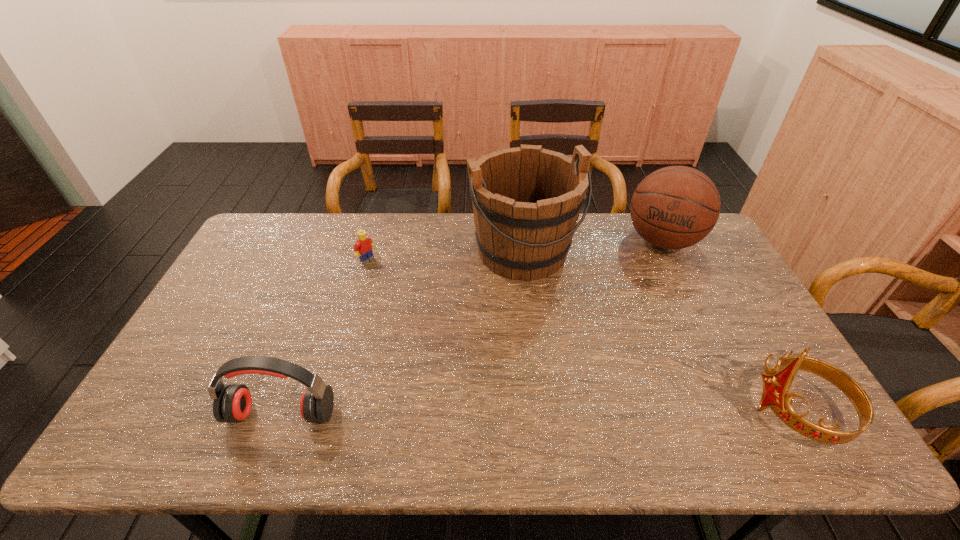
Where is `basketball located in the far edge section of the desktop`? The width and height of the screenshot is (960, 540). basketball located in the far edge section of the desktop is located at coordinates (675, 207).

Identify the location of earphone that is at the near edge. (232, 403).

The height and width of the screenshot is (540, 960). I want to click on tiara that is at the near edge, so pyautogui.click(x=776, y=386).

The height and width of the screenshot is (540, 960). Identify the location of tiara situated at the right edge. (776, 386).

What are the coordinates of `basketball present at the right edge` in the screenshot? It's located at (675, 207).

Find the location of `object located in the far right corner section of the desktop`. object located in the far right corner section of the desktop is located at coordinates (675, 207).

You are a GUI agent. You are given a task and a screenshot of the screen. Output one action in this format:
    pyautogui.click(x=<x>, y=<y>)
    Task: Click on the object located in the near right corner section of the desktop
    The image size is (960, 540).
    Given the screenshot: What is the action you would take?
    pyautogui.click(x=776, y=386)

This screenshot has width=960, height=540. I want to click on vacant point at the far edge, so click(x=317, y=217).

What are the coordinates of `vacant space at the near edge of the desktop` in the screenshot? It's located at (421, 410).

The width and height of the screenshot is (960, 540). I want to click on vacant position at the right edge of the desktop, so click(x=748, y=336).